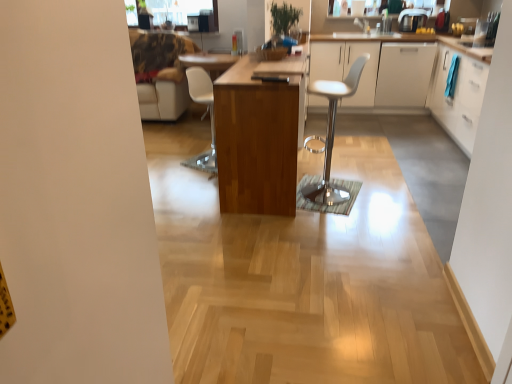
Question: Should I look upward or downward to see white glossy cabinet at upper right, which is the first cabinetry from left to right?

Choices:
 (A) down
 (B) up

Answer: (B)

Question: Is white leather stool at center, the 1th chair viewed from the front, far from white glossy cabinet at upper right, which is the first cabinetry from left to right?

Choices:
 (A) yes
 (B) no

Answer: (A)

Question: Would you say white leather stool at center, the 1th chair viewed from the front, is outside white glossy cabinet at upper right, the fourth cabinetry from the right?

Choices:
 (A) no
 (B) yes

Answer: (B)

Question: Does white leather stool at center, arranged as the first chair when viewed from the right, touch white glossy cabinet at upper right, which is the first cabinetry from left to right?

Choices:
 (A) yes
 (B) no

Answer: (B)

Question: Is white leather stool at center, arranged as the first chair when viewed from the right, closer to camera compared to white glossy cabinet at upper right, which is the first cabinetry from left to right?

Choices:
 (A) no
 (B) yes

Answer: (B)

Question: From a real-world perspective, is white leather stool at center, positioned as the second chair in back-to-front order, under white glossy cabinet at upper right, which is the first cabinetry from left to right?

Choices:
 (A) yes
 (B) no

Answer: (B)

Question: Does white leather stool at center, the 1th chair viewed from the front, appear on the left side of white glossy cabinet at upper right, which is the first cabinetry from left to right?

Choices:
 (A) yes
 (B) no

Answer: (A)

Question: From a real-world perspective, is metallic silver coffee maker at upper right positioned over wooden table at center based on gravity?

Choices:
 (A) no
 (B) yes

Answer: (B)

Question: Considering the relative positions of metallic silver coffee maker at upper right and wooden table at center in the image provided, is metallic silver coffee maker at upper right to the left of wooden table at center from the viewer's perspective?

Choices:
 (A) yes
 (B) no

Answer: (B)

Question: Is metallic silver coffee maker at upper right oriented away from wooden table at center?

Choices:
 (A) yes
 (B) no

Answer: (B)

Question: Is metallic silver coffee maker at upper right taller than wooden table at center?

Choices:
 (A) yes
 (B) no

Answer: (B)

Question: Is wooden table at center located within metallic silver coffee maker at upper right?

Choices:
 (A) yes
 (B) no

Answer: (B)

Question: From a real-world perspective, is metallic silver coffee maker at upper right under wooden table at center?

Choices:
 (A) no
 (B) yes

Answer: (A)

Question: Is white glossy cabinet at upper right, the fourth cabinetry from the right, directly adjacent to white matte cabinet at right, which appears as the 3th cabinetry when viewed from the left?

Choices:
 (A) yes
 (B) no

Answer: (B)